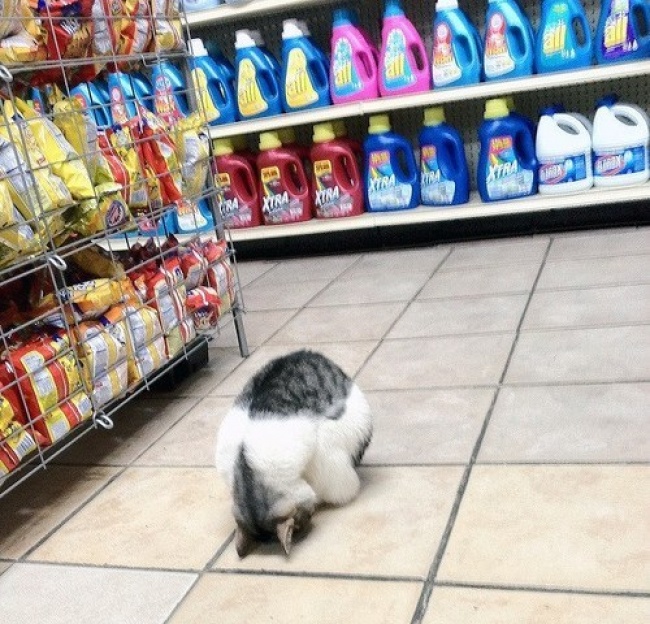
Image resolution: width=650 pixels, height=624 pixels. I want to click on floor, so click(x=439, y=376).